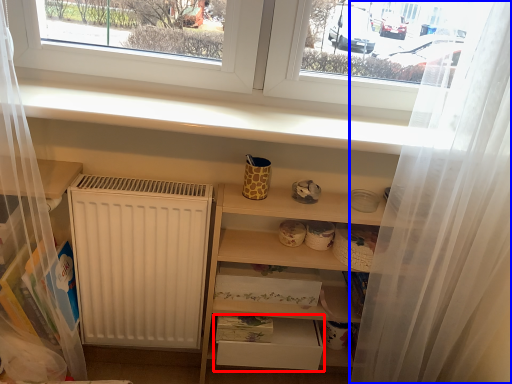
Question: Which of the following is the farthest to the observer, drawer (highlighted by a red box) or shower curtain (highlighted by a blue box)?

Choices:
 (A) drawer
 (B) shower curtain

Answer: (A)